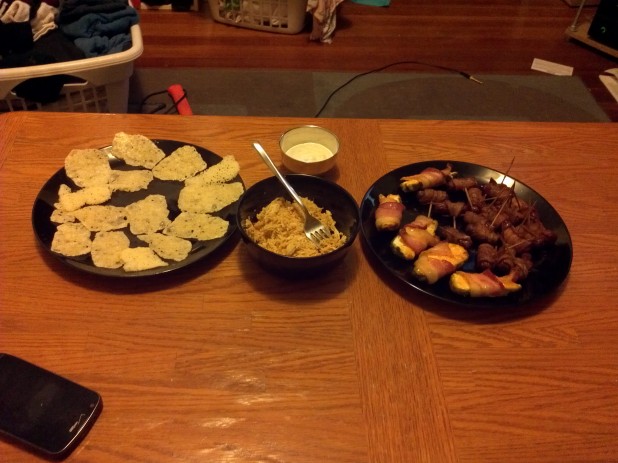
The image size is (618, 463). I want to click on clothes hampers, so click(x=111, y=73), click(x=295, y=24).